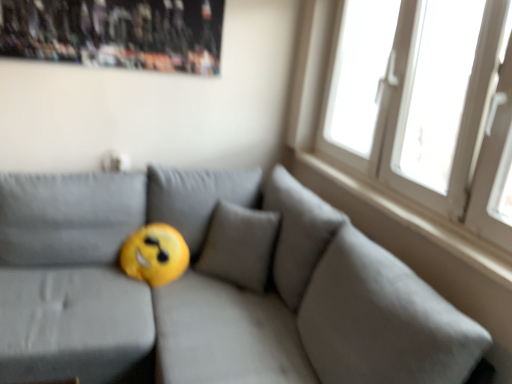
Question: Can you confirm if white smooth window sill at upper right is wider than yellow fabric pillow at center?

Choices:
 (A) no
 (B) yes

Answer: (A)

Question: From a real-world perspective, is white smooth window sill at upper right on yellow fabric pillow at center?

Choices:
 (A) yes
 (B) no

Answer: (A)

Question: Is white smooth window sill at upper right taller than yellow fabric pillow at center?

Choices:
 (A) yes
 (B) no

Answer: (B)

Question: Is white smooth window sill at upper right positioned in front of yellow fabric pillow at center?

Choices:
 (A) yes
 (B) no

Answer: (B)

Question: Considering the relative sizes of white smooth window sill at upper right and yellow fabric pillow at center in the image provided, is white smooth window sill at upper right smaller than yellow fabric pillow at center?

Choices:
 (A) no
 (B) yes

Answer: (B)

Question: Is white smooth window sill at upper right oriented towards yellow fabric pillow at center?

Choices:
 (A) no
 (B) yes

Answer: (A)

Question: Does white plastic window at upper right have a lesser width compared to yellow fabric pillow at center?

Choices:
 (A) yes
 (B) no

Answer: (A)

Question: Is white plastic window at upper right further to the viewer compared to yellow fabric pillow at center?

Choices:
 (A) yes
 (B) no

Answer: (A)

Question: From the image's perspective, is white plastic window at upper right under yellow fabric pillow at center?

Choices:
 (A) no
 (B) yes

Answer: (A)

Question: Can you see white plastic window at upper right touching yellow fabric pillow at center?

Choices:
 (A) no
 (B) yes

Answer: (A)

Question: Can we say white plastic window at upper right lies outside yellow fabric pillow at center?

Choices:
 (A) no
 (B) yes

Answer: (B)

Question: From the image's perspective, does white plastic window at upper right appear higher than yellow fabric pillow at center?

Choices:
 (A) yes
 (B) no

Answer: (A)

Question: From a real-world perspective, is wooden poster at upper left over white plastic window at upper right?

Choices:
 (A) yes
 (B) no

Answer: (A)